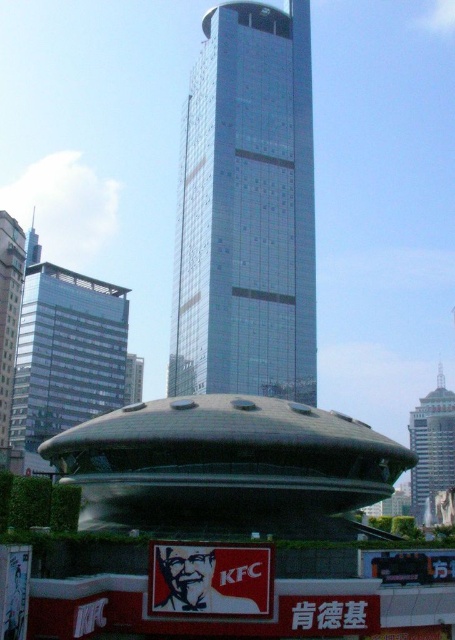
Question: Which object is the farthest from the glassy silver skyscraper at left?

Choices:
 (A) glassy metallic skyscraper at center
 (B) glassy metallic skyscraper at left
 (C) shiny silver tower at upper right

Answer: (C)

Question: Which of the following is the closest to the observer?

Choices:
 (A) glassy metallic skyscraper at center
 (B) glassy metallic skyscraper at left
 (C) glassy silver skyscraper at left

Answer: (A)

Question: Considering the real-world distances, which object is farthest from the shiny silver tower at upper right?

Choices:
 (A) glassy metallic skyscraper at left
 (B) glassy metallic skyscraper at center

Answer: (B)

Question: Where is glassy metallic skyscraper at center located in relation to glassy silver skyscraper at left in the image?

Choices:
 (A) left
 (B) right

Answer: (B)

Question: Can you confirm if glassy metallic skyscraper at center is wider than glassy metallic skyscraper at left?

Choices:
 (A) no
 (B) yes

Answer: (B)

Question: From the image, what is the correct spatial relationship of shiny silver tower at upper right in relation to glassy silver skyscraper at left?

Choices:
 (A) right
 (B) left

Answer: (A)